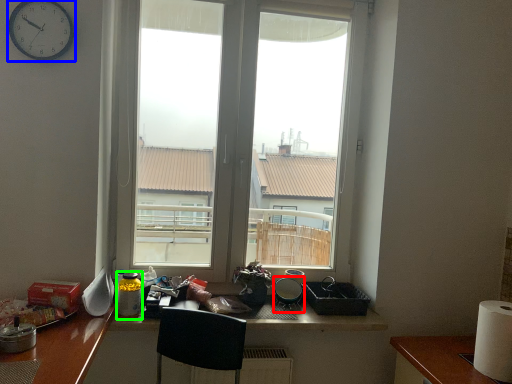
Question: Which object is the closest to the appliance (highlighted by a red box)? Choose among these: clock (highlighted by a blue box) or bottle (highlighted by a green box).

Choices:
 (A) clock
 (B) bottle

Answer: (B)